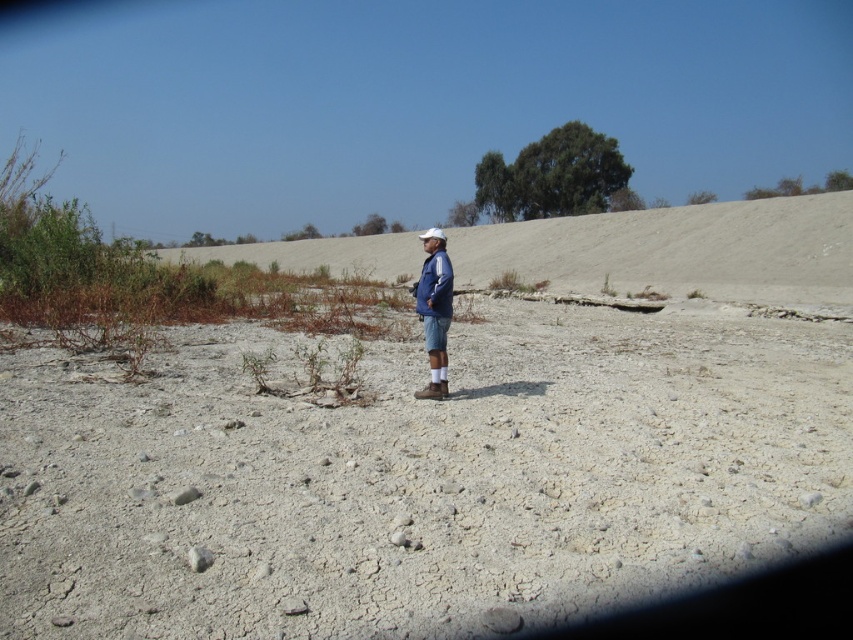
Question: Can you confirm if gray gravelly sand at center is thinner than blue denim jacket at center?

Choices:
 (A) yes
 (B) no

Answer: (B)

Question: Is gray gravelly sand at center in front of smooth sand hill at center?

Choices:
 (A) yes
 (B) no

Answer: (A)

Question: Which point is closer to the camera taking this photo?

Choices:
 (A) (444, 394)
 (B) (833, 413)
 (C) (776, 209)

Answer: (B)

Question: Does smooth sand hill at center appear on the right side of blue denim jacket at center?

Choices:
 (A) no
 (B) yes

Answer: (B)

Question: Among these objects, which one is nearest to the camera?

Choices:
 (A) blue denim jacket at center
 (B) smooth sand hill at center

Answer: (A)

Question: Which object is positioned closest to the smooth sand hill at center?

Choices:
 (A) blue denim jacket at center
 (B) gray gravelly sand at center

Answer: (B)